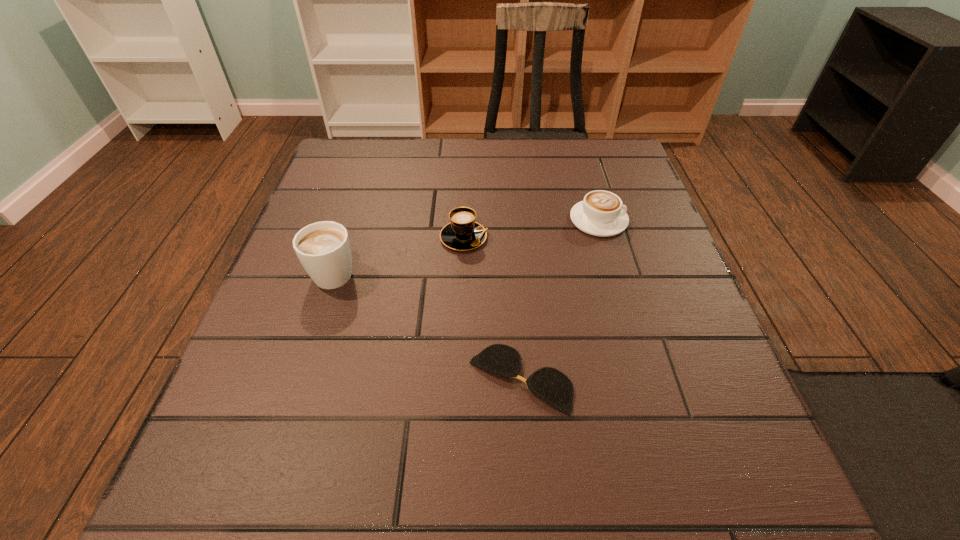
Locate an element on the screen. This screenshot has width=960, height=540. vacant space located 0.400m on the back of the shortest object is located at coordinates [508, 204].

You are a GUI agent. You are given a task and a screenshot of the screen. Output one action in this format:
    pyautogui.click(x=<x>, y=<y>)
    Task: Click on the object that is at the left edge
    This screenshot has height=540, width=960.
    Given the screenshot: What is the action you would take?
    pyautogui.click(x=323, y=248)

Locate an element on the screen. The image size is (960, 540). object that is at the right edge is located at coordinates (600, 213).

Locate an element on the screen. The image size is (960, 540). vacant area at the far edge of the desktop is located at coordinates (400, 156).

In the image, there is a desktop. In order to click on free space at the near edge in this screenshot , I will do `click(404, 470)`.

Identify the location of free space at the left edge of the desktop. This screenshot has width=960, height=540. (359, 282).

In the image, there is a desktop. Find the location of `vacant space at the right edge`. vacant space at the right edge is located at coordinates (649, 261).

Locate an element on the screen. The image size is (960, 540). vacant space at the far left corner of the desktop is located at coordinates (368, 138).

Locate an element on the screen. vacant area at the far right corner is located at coordinates (582, 140).

At what (x,y) coordinates should I click in order to perform the action: click on free spot between the second cappuccino from left to right and the rightmost cappuccino. Please return your answer as a coordinate pair (x, y). Looking at the image, I should click on (531, 228).